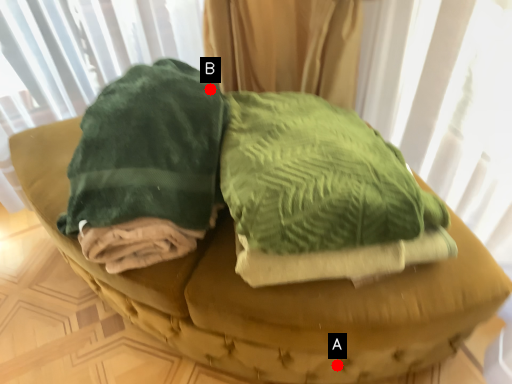
Question: Two points are circled on the image, labeled by A and B beside each circle. Which of the following is the farthest from the observer?

Choices:
 (A) A is further
 (B) B is further

Answer: (A)